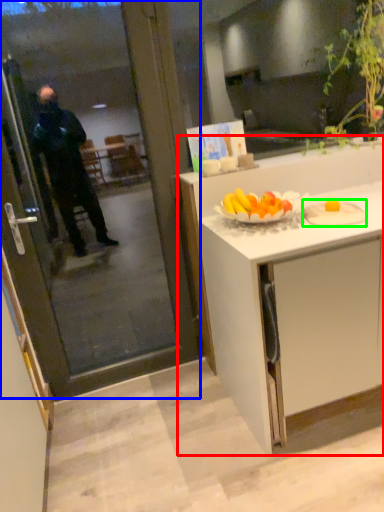
Question: Based on their relative distances, which object is nearer to cabinetry (highlighted by a red box)? Choose from screen door (highlighted by a blue box) and plate (highlighted by a green box).

Choices:
 (A) screen door
 (B) plate

Answer: (B)